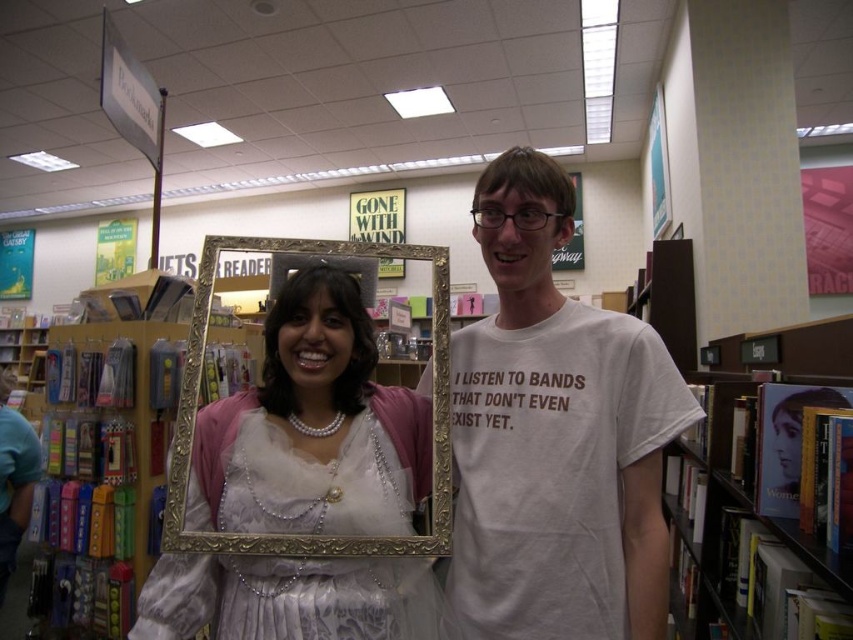
Question: Can you confirm if wooden bookshelf at left is bigger than hardcover book at center?

Choices:
 (A) no
 (B) yes

Answer: (A)

Question: Does wooden bookshelf at left have a lesser width compared to hardcover book at center?

Choices:
 (A) yes
 (B) no

Answer: (B)

Question: Is white lace dress at center to the right of wooden bookshelf at left from the viewer's perspective?

Choices:
 (A) no
 (B) yes

Answer: (B)

Question: Which of the following is the closest to the observer?

Choices:
 (A) (727, 573)
 (B) (332, 406)

Answer: (B)

Question: Which of the following is the closest to the observer?

Choices:
 (A) (61, 550)
 (B) (137, 612)
 (C) (717, 465)
 (D) (659, 522)

Answer: (D)

Question: Among these points, which one is farthest from the camera?

Choices:
 (A) (786, 586)
 (B) (44, 426)

Answer: (B)